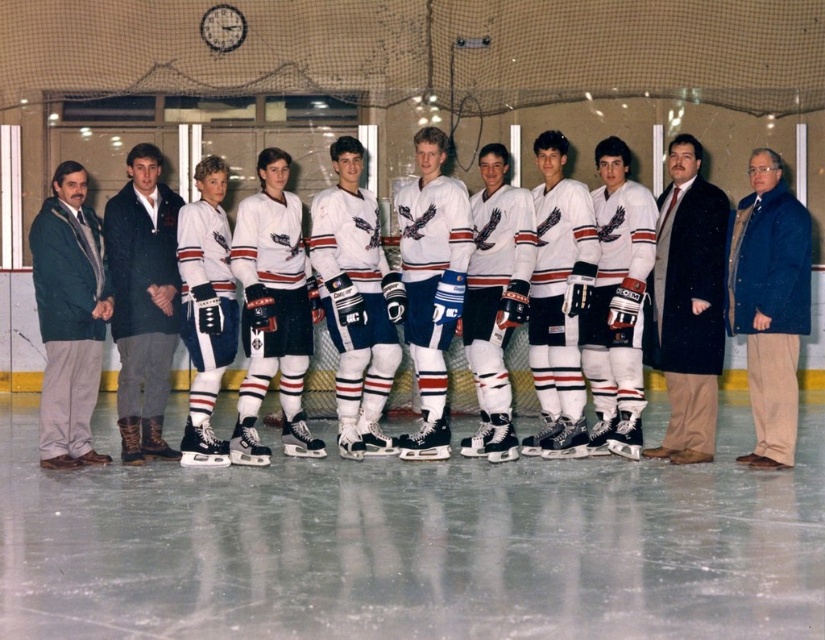
You are a photographer standing at the edge of the rink. You need to capture a photo where both the white ice at center and the white jersey at center are visible. Based on their heights, which one will appear closer to the camera in the photo?

The white jersey at center appears closer to the camera because it is taller than the white ice at center.

You are a photographer setting up for the team photo. You have a dark blue wool coat at right and a dark blue corduroy pants at center. Which item is bigger in size?

The dark blue wool coat at right has a larger size compared to the dark blue corduroy pants at center, so the dark blue wool coat at right is bigger.

You are a photographer standing at the center of the ice rink. You want to place a small marker at the point with coordinates point (413, 547). Where should you place the marker?

The point (413, 547) corresponds to white ice at center, so you should place the marker on the white ice at center.